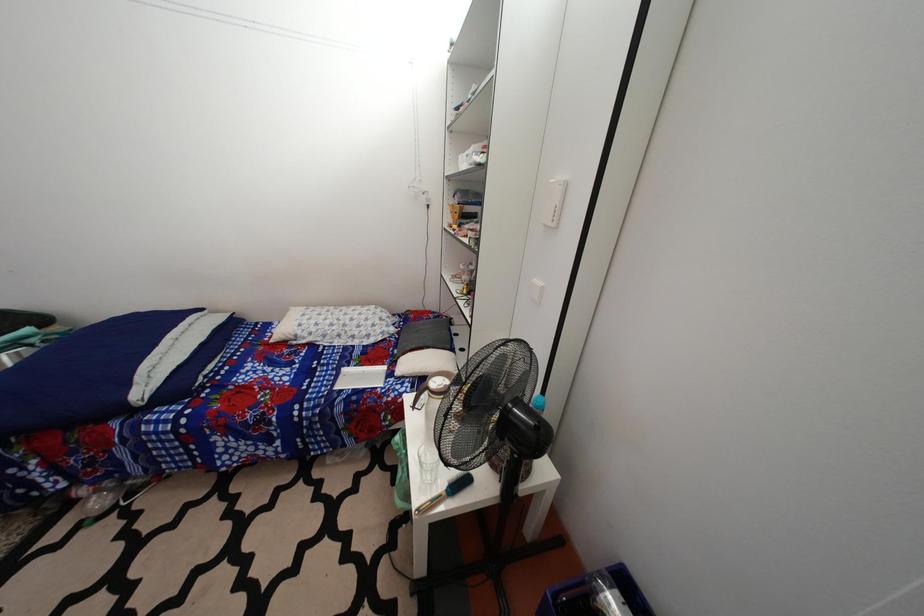
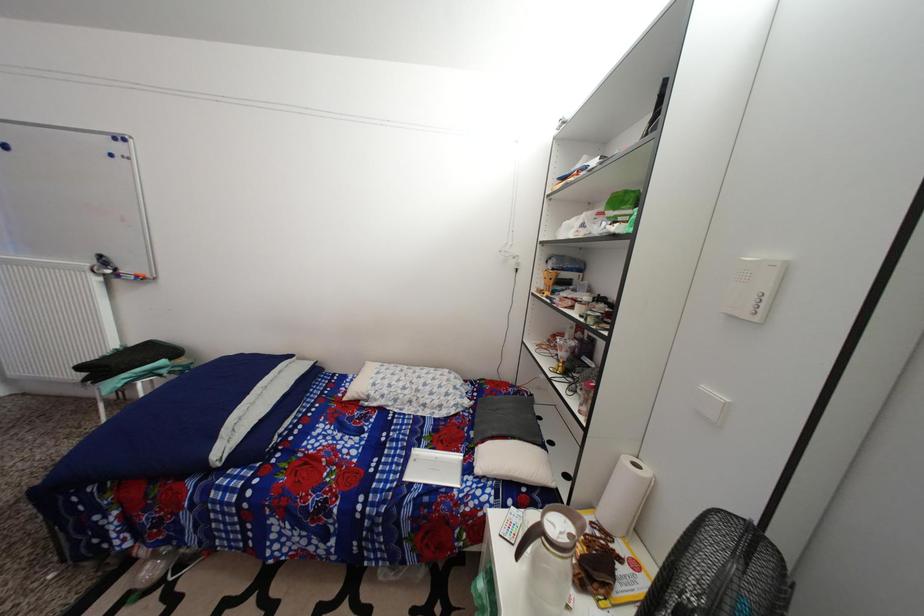
Which direction would the cameraman need to move to produce the second image?

The cameraman moved toward left, forward.